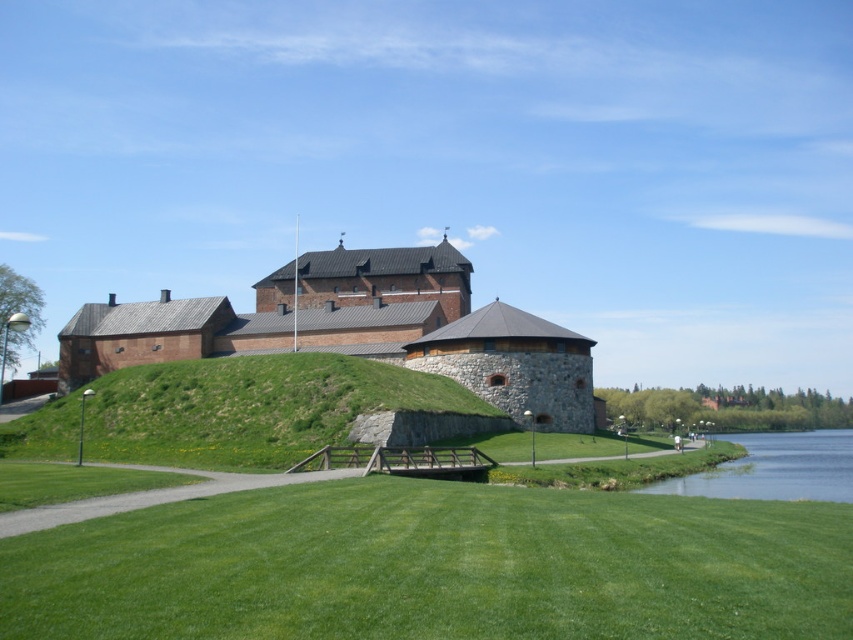
You are standing on the wooden bridge in front of the castle. You notice two points marked on the ground ahead of you. The first is at point coordinates point [578,428] and the second is at point coordinates point [7,433]. Which point is closer to you?

Point [578,428] is further to the viewer than point [7,433], so the point closer to you is point [7,433].

You are a visitor approaching the castle from the wooden bridge. As you walk towards the entrance, which object will you encounter first between the brown stone castle at center and the green grassy hillside at center?

You will encounter the brown stone castle at center first because the green grassy hillside at center is located behind it.